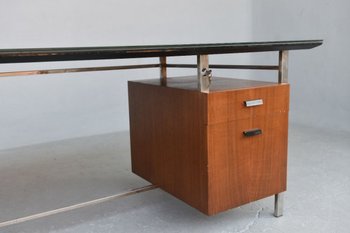
Image resolution: width=350 pixels, height=233 pixels. Find the location of `handles`. handles is located at coordinates pyautogui.click(x=256, y=102), pyautogui.click(x=253, y=131).